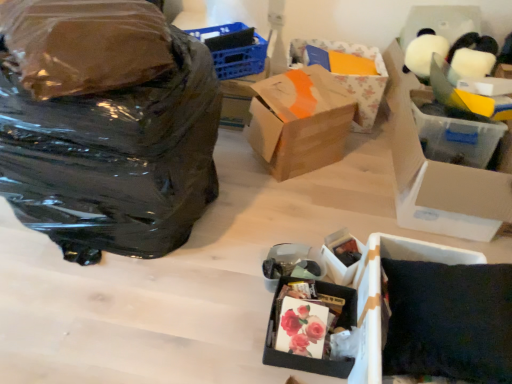
Identify the location of vacant area that lies between black plastic bag at left and matte black box at lower center, which is counted as the second box, starting from the bottom. This screenshot has width=512, height=384. (239, 229).